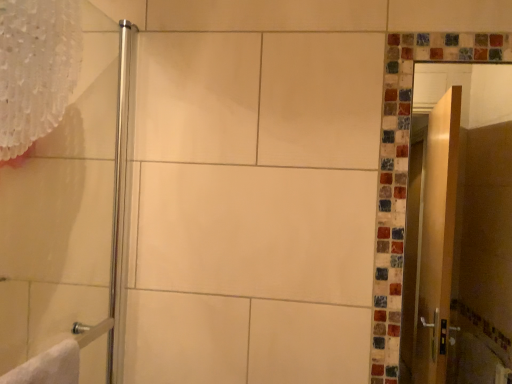
Describe the element at coordinates (36, 68) in the screenshot. I see `white lace curtain at upper left` at that location.

What is the approximate width of polished chrome shower door at left?

2.42 inches.

Identify the location of white lace curtain at upper left. (36, 68).

Is the surface of white lace curtain at upper left in direct contact with polished chrome shower door at left?

No, white lace curtain at upper left is not touching polished chrome shower door at left.

Considering the points (2, 64) and (39, 327), which point is in front, point (2, 64) or point (39, 327)?

The point (2, 64) is in front.

Considering the sizes of white lace curtain at upper left and polished chrome shower door at left in the image, is white lace curtain at upper left taller or shorter than polished chrome shower door at left?

white lace curtain at upper left is shorter than polished chrome shower door at left.

Is white lace curtain at upper left positioned beyond the bounds of polished chrome shower door at left?

Actually, white lace curtain at upper left is at least partially inside polished chrome shower door at left.

Who is smaller, polished chrome shower door at left or wooden screen door at right?

wooden screen door at right is smaller.

Is polished chrome shower door at left not within wooden screen door at right?

Absolutely, polished chrome shower door at left is external to wooden screen door at right.

Considering the positions of objects polished chrome shower door at left and wooden screen door at right in the image provided, who is more to the right, polished chrome shower door at left or wooden screen door at right?

wooden screen door at right is more to the right.

Is polished chrome shower door at left wider or thinner than white lace curtain at upper left?

In the image, polished chrome shower door at left appears to be more narrow than white lace curtain at upper left.

Does point (68, 283) lie in front of point (14, 67)?

No, it is behind (14, 67).

In terms of height, does polished chrome shower door at left look taller or shorter compared to white lace curtain at upper left?

Considering their sizes, polished chrome shower door at left has more height than white lace curtain at upper left.

Can we say polished chrome shower door at left lies outside white lace curtain at upper left?

polished chrome shower door at left is positioned outside white lace curtain at upper left.

From the image's perspective, which is below, wooden screen door at right or white lace curtain at upper left?

wooden screen door at right is shown below in the image.

From the picture: Considering the relative sizes of wooden screen door at right and white lace curtain at upper left in the image provided, is wooden screen door at right taller than white lace curtain at upper left?

Correct, wooden screen door at right is much taller as white lace curtain at upper left.

From a real-world perspective, which object rests below the other?

From a 3D spatial view, wooden screen door at right is below.

Which object is positioned more to the right, wooden screen door at right or white lace curtain at upper left?

From the viewer's perspective, wooden screen door at right appears more on the right side.

From a real-world perspective, is wooden screen door at right above or below polished chrome shower door at left?

Clearly, from a real-world perspective, wooden screen door at right is above polished chrome shower door at left.

Is wooden screen door at right bigger than polished chrome shower door at left?

No.

From the image's perspective, is wooden screen door at right located above or below polished chrome shower door at left?

Clearly, from the image's perspective, wooden screen door at right is below polished chrome shower door at left.

Between white lace curtain at upper left and wooden screen door at right, which one has more height?

With more height is wooden screen door at right.

How different are the orientations of white lace curtain at upper left and wooden screen door at right in degrees?

white lace curtain at upper left and wooden screen door at right are facing 90.1 degrees away from each other.

Between point (8, 119) and point (501, 111), which one is positioned in front?

The point (8, 119) is more forward.

Consider the image. Who is smaller, white lace curtain at upper left or wooden screen door at right?

Smaller between the two is white lace curtain at upper left.

The height and width of the screenshot is (384, 512). I want to click on shower door beneath the white lace curtain at upper left (from a real-world perspective), so click(x=62, y=210).

You are a GUI agent. You are given a task and a screenshot of the screen. Output one action in this format:
    pyautogui.click(x=<x>, y=<y>)
    Task: Click on the screen door below the polished chrome shower door at left (from the image's perspective)
    Image resolution: width=512 pixels, height=384 pixels.
    Given the screenshot: What is the action you would take?
    pyautogui.click(x=462, y=225)

Consider the image. Based on their spatial positions, is wooden screen door at right or white lace curtain at upper left closer to polished chrome shower door at left?

The object closer to polished chrome shower door at left is white lace curtain at upper left.

When comparing their distances from wooden screen door at right, does white lace curtain at upper left or polished chrome shower door at left seem closer?

polished chrome shower door at left is positioned closer to the anchor wooden screen door at right.

Considering their positions, is polished chrome shower door at left positioned further to wooden screen door at right than white lace curtain at upper left?

white lace curtain at upper left is positioned further to the anchor wooden screen door at right.

Estimate the real-world distances between objects in this image. Which object is closer to white lace curtain at upper left, polished chrome shower door at left or wooden screen door at right?

Among the two, polished chrome shower door at left is located nearer to white lace curtain at upper left.

When comparing their distances from polished chrome shower door at left, does white lace curtain at upper left or wooden screen door at right seem further?

The object further to polished chrome shower door at left is wooden screen door at right.

Based on their spatial positions, is wooden screen door at right or polished chrome shower door at left closer to white lace curtain at upper left?

polished chrome shower door at left is positioned closer to the anchor white lace curtain at upper left.

This screenshot has height=384, width=512. What are the coordinates of `shower door situated between white lace curtain at upper left and wooden screen door at right from left to right` in the screenshot? It's located at (62, 210).